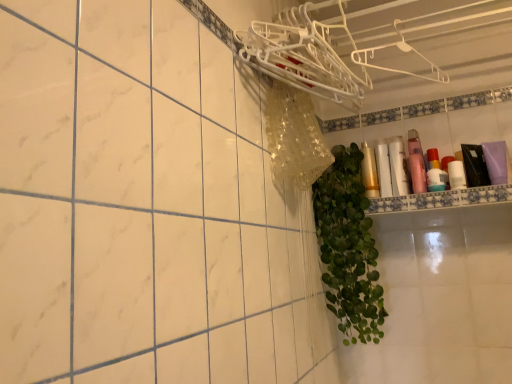
Question: From the image's perspective, relative to gold metallic can at center, which appears as the fifth toiletry when viewed from the right, is white glossy shelf at upper right above or below?

Choices:
 (A) below
 (B) above

Answer: (A)

Question: Considering the positions of white glossy shelf at upper right and gold metallic can at center, which appears as the fifth toiletry when viewed from the right, in the image, is white glossy shelf at upper right bigger or smaller than gold metallic can at center, which appears as the fifth toiletry when viewed from the right,?

Choices:
 (A) small
 (B) big

Answer: (B)

Question: Considering the real-world distances, which object is closest to the translucent plastic bottles at upper right, the 1th toiletry in the right-to-left sequence?

Choices:
 (A) white plastic hanger at upper right, which appears as the 2th hanger when viewed from the left
 (B) white glossy shelf at upper right
 (C) green leafy plant at right
 (D) matte gold tube at upper right, which is the 4th toiletry from right to left
 (E) white plastic hanger at upper right, which ranks as the second hanger in right-to-left order

Answer: (B)

Question: Estimate the real-world distances between objects in this image. Which object is farther from the matte gold tube at upper right, which is the 4th toiletry from right to left?

Choices:
 (A) gold metallic can at center, which is the first toiletry in left-to-right order
 (B) translucent plastic bottles at upper right, the 1th toiletry in the right-to-left sequence
 (C) white plastic hanger at upper right, which ranks as the second hanger in right-to-left order
 (D) green leafy plant at right
 (E) white plastic hanger at upper right, which appears as the 2th hanger when viewed from the left

Answer: (C)